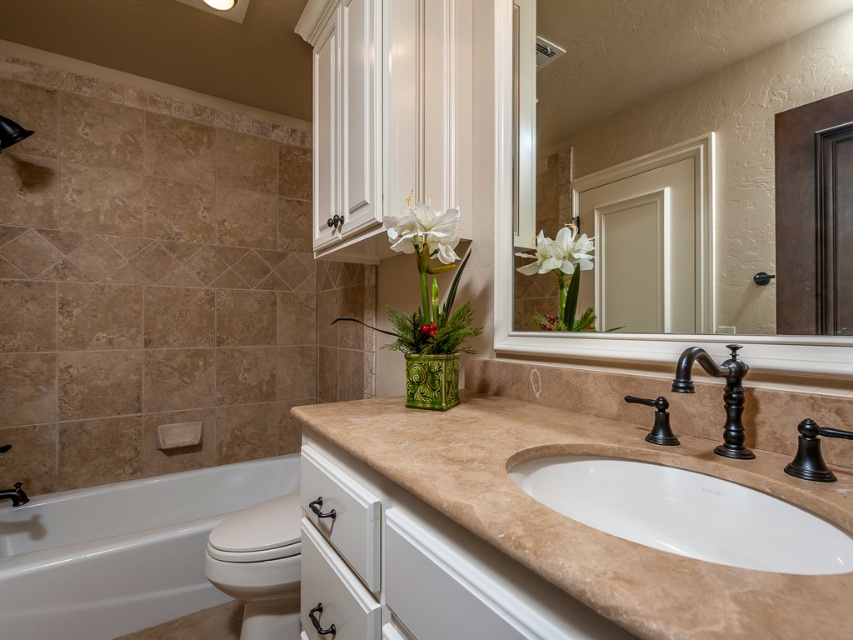
Question: Is white glossy bathtub at lower left positioned behind matte glass mirror at upper center?

Choices:
 (A) no
 (B) yes

Answer: (B)

Question: Which object appears farthest from the camera in this image?

Choices:
 (A) green glossy vase at center
 (B) white glossy flower at center
 (C) white matte vase at upper center

Answer: (B)

Question: Can you confirm if white glossy bathtub at lower left is positioned above green glossy vase at center?

Choices:
 (A) yes
 (B) no

Answer: (B)

Question: Where is matte glass mirror at upper center located in relation to green glossy vase at center in the image?

Choices:
 (A) above
 (B) below

Answer: (A)

Question: Among these points, which one is nearest to the camera?

Choices:
 (A) (730, 352)
 (B) (590, 481)

Answer: (A)

Question: Which point is farther to the camera?

Choices:
 (A) white marble sink at center
 (B) oil-rubbed bronze faucet at lower center
 (C) white matte vase at upper center

Answer: (C)